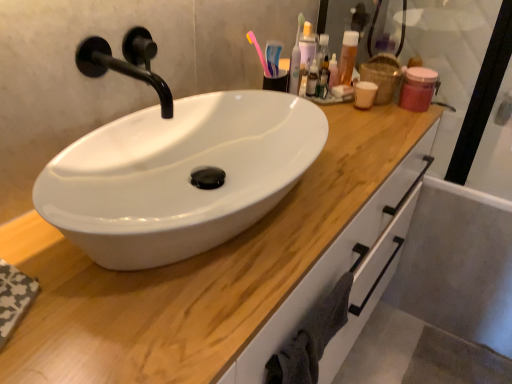
Question: From a real-world perspective, is white glossy drawer at right above or below black matte faucet at upper left?

Choices:
 (A) above
 (B) below

Answer: (B)

Question: Is point (498, 274) positioned closer to the camera than point (106, 66)?

Choices:
 (A) farther
 (B) closer

Answer: (A)

Question: Which object is the farthest from the black matte faucet at upper left?

Choices:
 (A) translucent plastic bottle at upper right
 (B) white glossy drawer at right
 (C) wooden at center
 (D) pink plastic toothbrush at upper right
 (E) gray cotton towel at lower right

Answer: (B)

Question: Which of these objects is positioned closest to the black matte faucet at upper left?

Choices:
 (A) wooden at center
 (B) white glossy drawer at right
 (C) translucent plastic bottle at upper right
 (D) gray cotton towel at lower right
 (E) pink plastic toothbrush at upper right

Answer: (A)